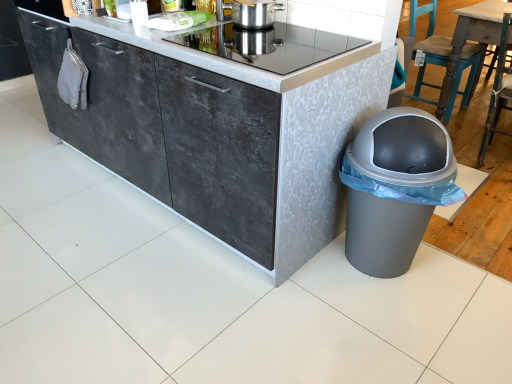
Identify the location of wooden chair at right, which ranks as the first chair in front-to-back order. (498, 91).

You are a GUI agent. You are given a task and a screenshot of the screen. Output one action in this format:
    pyautogui.click(x=<x>, y=<y>)
    Task: Click on the stainless steel pot at upper center
    
    Given the screenshot: What is the action you would take?
    pyautogui.click(x=255, y=13)

What do you see at coordinates (269, 45) in the screenshot? The image size is (512, 384). I see `metallic glass cooktop at center` at bounding box center [269, 45].

What do you see at coordinates (430, 58) in the screenshot? I see `teal painted wood chair at right, positioned as the 2th chair in front-to-back order` at bounding box center [430, 58].

Where is `dark gray concrete cabinet at center`? dark gray concrete cabinet at center is located at coordinates (227, 133).

What is the approximate width of dark gray concrete cabinet at center?

23.72 inches.

Where is `wooden chair at right, which ranks as the first chair in front-to-back order`? wooden chair at right, which ranks as the first chair in front-to-back order is located at coordinates (498, 91).

Which object is wider, teal painted wood chair at right, which is the 1th chair from back to front, or gray plastic trash can at lower right?

teal painted wood chair at right, which is the 1th chair from back to front, is wider.

From a real-world perspective, is teal painted wood chair at right, positioned as the 2th chair in front-to-back order, above or below gray plastic trash can at lower right?

teal painted wood chair at right, positioned as the 2th chair in front-to-back order, is above gray plastic trash can at lower right.

Between point (438, 45) and point (391, 238), which one is positioned in front?

The point (391, 238) is closer.

Between teal painted wood chair at right, positioned as the 2th chair in front-to-back order, and gray plastic trash can at lower right, which one has larger size?

teal painted wood chair at right, positioned as the 2th chair in front-to-back order.

From a real-world perspective, which is physically above, teal painted wood chair at right, which is the 1th chair from back to front, or stainless steel pot at upper center?

From a 3D spatial view, stainless steel pot at upper center is above.

Considering the positions of objects teal painted wood chair at right, positioned as the 2th chair in front-to-back order, and stainless steel pot at upper center in the image provided, who is behind, teal painted wood chair at right, positioned as the 2th chair in front-to-back order, or stainless steel pot at upper center?

Positioned behind is teal painted wood chair at right, positioned as the 2th chair in front-to-back order.

Between teal painted wood chair at right, which is the 1th chair from back to front, and stainless steel pot at upper center, which one has more height?

Standing taller between the two is teal painted wood chair at right, which is the 1th chair from back to front.

Considering the relative sizes of gray plastic trash can at lower right and dark gray concrete cabinet at center in the image provided, is gray plastic trash can at lower right wider than dark gray concrete cabinet at center?

Incorrect, the width of gray plastic trash can at lower right does not surpass that of dark gray concrete cabinet at center.

From the image's perspective, between gray plastic trash can at lower right and dark gray concrete cabinet at center, which one is located above?

dark gray concrete cabinet at center.

Which object is further away from the camera, gray plastic trash can at lower right or dark gray concrete cabinet at center?

Positioned behind is gray plastic trash can at lower right.

Is wooden chair at right, the 2th chair from the back, far away from gray plastic trash can at lower right?

Absolutely, wooden chair at right, the 2th chair from the back, is distant from gray plastic trash can at lower right.

From the picture: Is the depth of wooden chair at right, the 2th chair from the back, greater than that of gray plastic trash can at lower right?

Yes, wooden chair at right, the 2th chair from the back, is further from the camera.

Is wooden chair at right, the 2th chair from the back, facing away from gray plastic trash can at lower right?

Yes, wooden chair at right, the 2th chair from the back, is facing away from gray plastic trash can at lower right.

Measure the distance from wooden chair at right, the 2th chair from the back, to gray plastic trash can at lower right.

They are 1.12 meters apart.

Can you tell me how much stainless steel pot at upper center and teal painted wood chair at right, which is the 1th chair from back to front, differ in facing direction?

The facing directions of stainless steel pot at upper center and teal painted wood chair at right, which is the 1th chair from back to front, are 92.9 degrees apart.

Which of these two, stainless steel pot at upper center or teal painted wood chair at right, positioned as the 2th chair in front-to-back order, is bigger?

With larger size is teal painted wood chair at right, positioned as the 2th chair in front-to-back order.

Considering the points (249, 5) and (421, 47), which point is in front, point (249, 5) or point (421, 47)?

Positioned in front is point (249, 5).

Is stainless steel pot at upper center far from teal painted wood chair at right, which is the 1th chair from back to front?

Yes, stainless steel pot at upper center and teal painted wood chair at right, which is the 1th chair from back to front, are located far from each other.

From the picture: How much distance is there between teal painted wood chair at right, which is the 1th chair from back to front, and dark gray concrete cabinet at center?

The distance of teal painted wood chair at right, which is the 1th chair from back to front, from dark gray concrete cabinet at center is 1.85 meters.

Is teal painted wood chair at right, positioned as the 2th chair in front-to-back order, spatially inside dark gray concrete cabinet at center, or outside of it?

teal painted wood chair at right, positioned as the 2th chair in front-to-back order, is spatially situated outside dark gray concrete cabinet at center.

How different are the orientations of teal painted wood chair at right, which is the 1th chair from back to front, and dark gray concrete cabinet at center in degrees?

90.5 degrees separate the facing orientations of teal painted wood chair at right, which is the 1th chair from back to front, and dark gray concrete cabinet at center.

Which is behind, teal painted wood chair at right, positioned as the 2th chair in front-to-back order, or dark gray concrete cabinet at center?

Positioned behind is teal painted wood chair at right, positioned as the 2th chair in front-to-back order.

From the image's perspective, which is above, stainless steel pot at upper center or wooden chair at right, the 2th chair from the back?

stainless steel pot at upper center appears higher in the image.

Considering the relative positions of stainless steel pot at upper center and wooden chair at right, which ranks as the first chair in front-to-back order, in the image provided, is stainless steel pot at upper center to the left or to the right of wooden chair at right, which ranks as the first chair in front-to-back order,?

Clearly, stainless steel pot at upper center is on the left of wooden chair at right, which ranks as the first chair in front-to-back order, in the image.

Would you say stainless steel pot at upper center is a long distance from wooden chair at right, the 2th chair from the back?

Yes.

Is point (263, 13) positioned behind point (486, 123)?

No, (263, 13) is in front of (486, 123).

Where is `the 1st chair to the right of the gray plastic trash can at lower right, counting from the anchor's position`? This screenshot has height=384, width=512. the 1st chair to the right of the gray plastic trash can at lower right, counting from the anchor's position is located at coordinates (430, 58).

Locate an element on the screen. The height and width of the screenshot is (384, 512). kitchen appliance below the teal painted wood chair at right, which is the 1th chair from back to front (from the image's perspective) is located at coordinates (255, 13).

From the image, which object appears to be nearer to teal painted wood chair at right, positioned as the 2th chair in front-to-back order, gray plastic trash can at lower right or metallic glass cooktop at center?

The object closer to teal painted wood chair at right, positioned as the 2th chair in front-to-back order, is gray plastic trash can at lower right.

Looking at the image, which one is located further to teal painted wood chair at right, which is the 1th chair from back to front, wooden chair at right, which ranks as the first chair in front-to-back order, or stainless steel pot at upper center?

stainless steel pot at upper center is further to teal painted wood chair at right, which is the 1th chair from back to front.

Which object lies further to the anchor point metallic glass cooktop at center, stainless steel pot at upper center or dark gray concrete cabinet at center?

dark gray concrete cabinet at center.

From the image, which object appears to be farther from wooden chair at right, the 2th chair from the back, dark gray concrete cabinet at center or stainless steel pot at upper center?

dark gray concrete cabinet at center is further to wooden chair at right, the 2th chair from the back.

Looking at the image, which one is located closer to teal painted wood chair at right, which is the 1th chair from back to front, dark gray concrete cabinet at center or metallic glass cooktop at center?

metallic glass cooktop at center lies closer to teal painted wood chair at right, which is the 1th chair from back to front, than the other object.

Consider the image. Which object lies further to the anchor point wooden chair at right, which ranks as the first chair in front-to-back order, teal painted wood chair at right, which is the 1th chair from back to front, or dark gray concrete cabinet at center?

dark gray concrete cabinet at center lies further to wooden chair at right, which ranks as the first chair in front-to-back order, than the other object.

Based on the photo, based on their spatial positions, is teal painted wood chair at right, which is the 1th chair from back to front, or stainless steel pot at upper center further from metallic glass cooktop at center?

teal painted wood chair at right, which is the 1th chair from back to front, is further to metallic glass cooktop at center.

Looking at the image, which one is located closer to stainless steel pot at upper center, gray plastic trash can at lower right or teal painted wood chair at right, which is the 1th chair from back to front?

The object closer to stainless steel pot at upper center is gray plastic trash can at lower right.

Identify the location of kitchen appliance between dark gray concrete cabinet at center and teal painted wood chair at right, positioned as the 2th chair in front-to-back order. The width and height of the screenshot is (512, 384). [255, 13].

At what (x,y) coordinates should I click in order to perform the action: click on chair between metallic glass cooktop at center and wooden chair at right, which ranks as the first chair in front-to-back order, in the horizontal direction. Please return your answer as a coordinate pair (x, y). The width and height of the screenshot is (512, 384). Looking at the image, I should click on (430, 58).

You are a GUI agent. You are given a task and a screenshot of the screen. Output one action in this format:
    pyautogui.click(x=<x>, y=<y>)
    Task: Click on the home appliance located between dark gray concrete cabinet at center and gray plastic trash can at lower right in the left-right direction
    
    Given the screenshot: What is the action you would take?
    pyautogui.click(x=269, y=45)

Identify the location of home appliance between dark gray concrete cabinet at center and wooden chair at right, the 2th chair from the back. This screenshot has width=512, height=384. (269, 45).